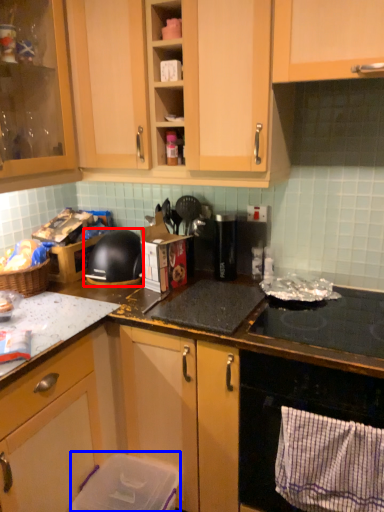
Question: Which object is closer to the camera taking this photo, kitchen appliance (highlighted by a red box) or appliance (highlighted by a blue box)?

Choices:
 (A) kitchen appliance
 (B) appliance

Answer: (B)